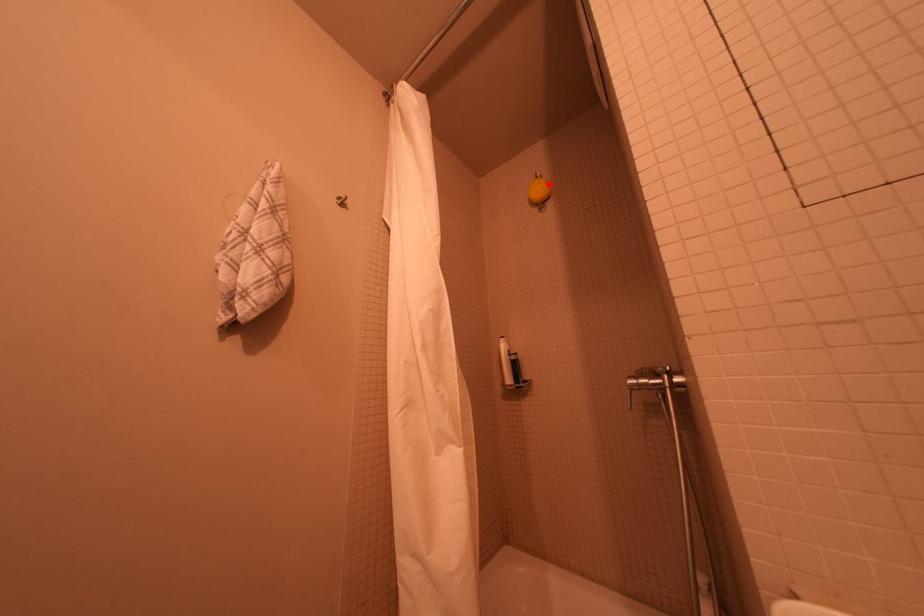
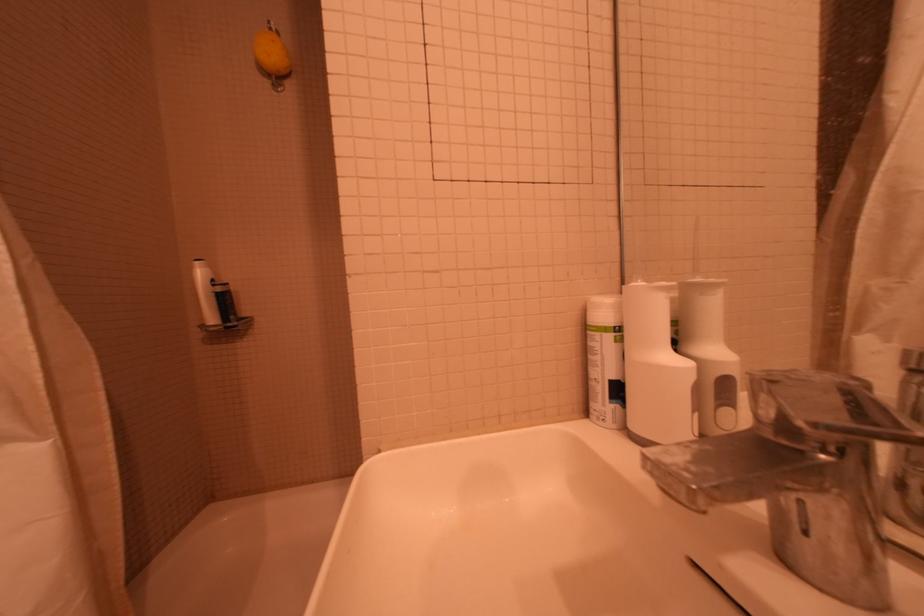
In the second image, find the point that corresponds to the highlighted location in the first image.

(281, 42)